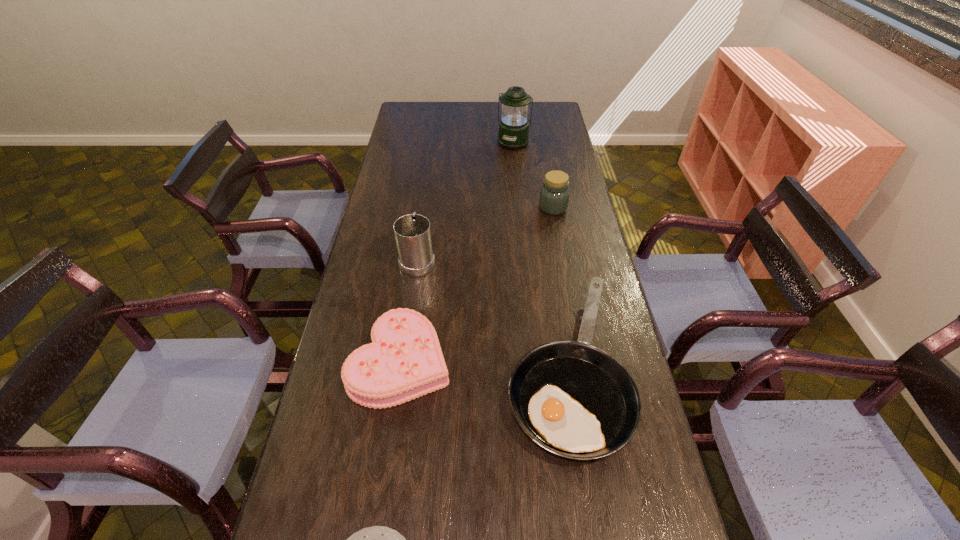
The image size is (960, 540). Find the location of `vacant position at the left edge of the desktop`. vacant position at the left edge of the desktop is located at coordinates (291, 521).

I want to click on vacant space at the right edge of the desktop, so click(586, 246).

At what (x,y) coordinates should I click in order to perform the action: click on free space at the far left corner. Please return your answer as a coordinate pair (x, y). Looking at the image, I should click on (413, 109).

In the image, there is a desktop. What are the coordinates of `vacant area at the far right corner` in the screenshot? It's located at (548, 120).

Where is `vacant region between the tallest object and the cake`? This screenshot has width=960, height=540. vacant region between the tallest object and the cake is located at coordinates point(457,252).

Identify the location of free space between the farthest object and the fifth nearest object. (534, 175).

This screenshot has height=540, width=960. I want to click on vacant space that is in between the lantern and the cake, so click(x=457, y=252).

Locate an element on the screen. free point between the frying pan and the farthest object is located at coordinates (540, 254).

Where is `empty location between the mug and the frying pan`? The height and width of the screenshot is (540, 960). empty location between the mug and the frying pan is located at coordinates (492, 313).

At what (x,y) coordinates should I click in order to perform the action: click on empty space that is in between the frying pan and the tallest object. Please return your answer as a coordinate pair (x, y). Looking at the image, I should click on (540, 254).